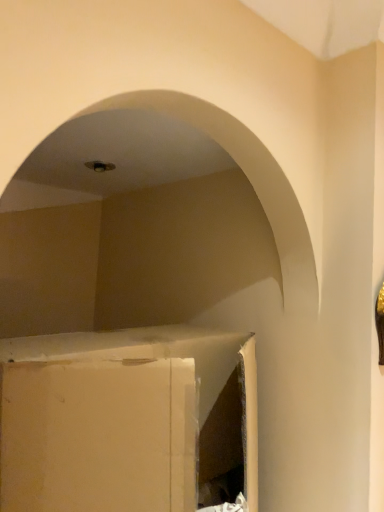
Measure the distance between matte cardboard box at center and camera.

matte cardboard box at center and camera are 23.71 inches apart.

This screenshot has height=512, width=384. Describe the element at coordinates (125, 419) in the screenshot. I see `matte cardboard box at center` at that location.

Find the location of `matte cardboard box at center`. matte cardboard box at center is located at coordinates (125, 419).

Locate an element on the screen. matte cardboard box at center is located at coordinates click(125, 419).